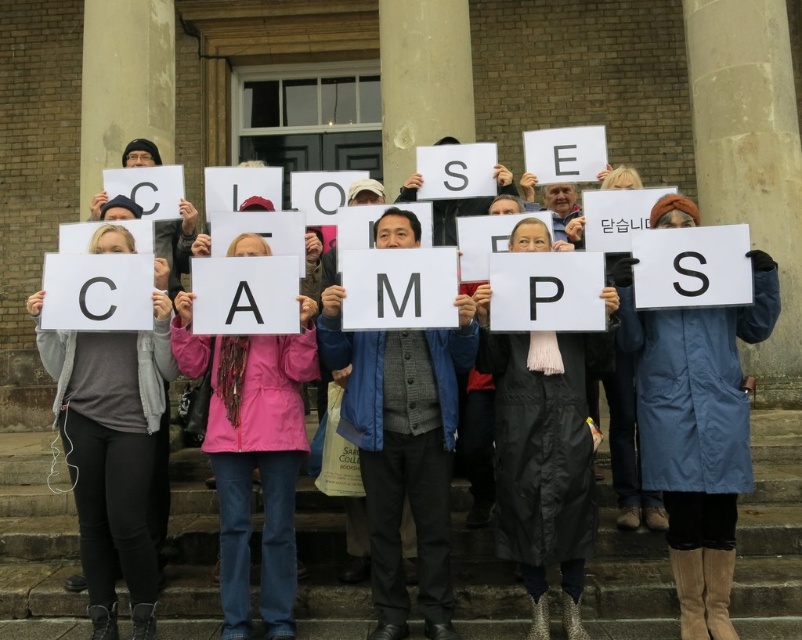
You are a photographer trying to capture the entire word spelled by the group. You notice the white paper sign at center and the matte gray jacket at center. Which object should you focus on to ensure the entire word is visible in your photo?

The white paper sign at center is bigger than the matte gray jacket at center, so focusing on the white paper sign at center will help capture the entire word since it is the larger object and likely part of the main message.

You are a photographer trying to capture a clear shot of the letters held by the group. You notice two points in the image at coordinates point (x=51, y=541) and point (x=401, y=444). Which point is closer to your camera lens?

Point (x=51, y=541) is further to the camera than point (x=401, y=444), so the point closer to the camera is point (x=401, y=444).